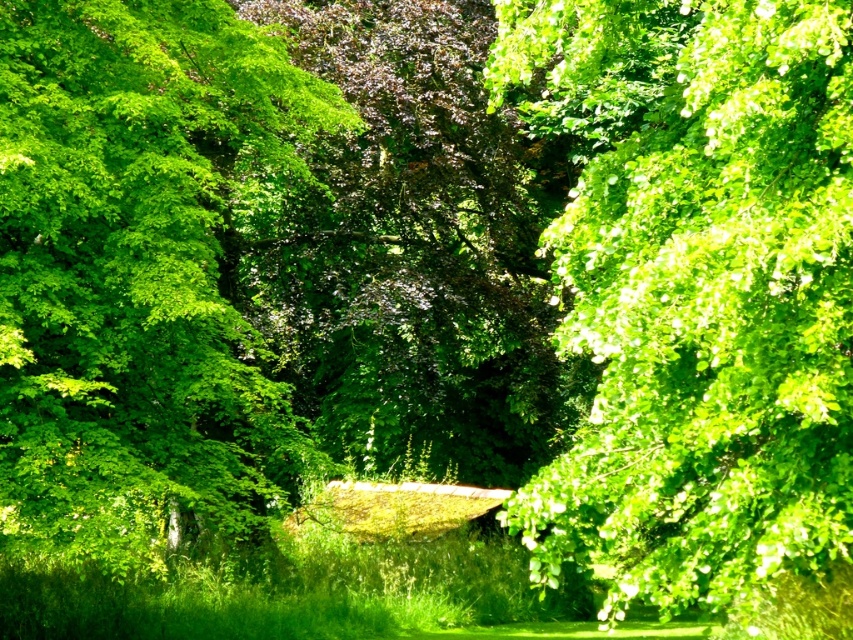
Does green leafy tree at left have a lesser height compared to green leafy tree at center?

Incorrect, green leafy tree at left's height does not fall short of green leafy tree at center's.

Is green leafy tree at left further to the viewer compared to green leafy tree at center?

No, green leafy tree at left is closer to the viewer.

Identify the location of green leafy tree at left. The width and height of the screenshot is (853, 640). (137, 275).

You are a GUI agent. You are given a task and a screenshot of the screen. Output one action in this format:
    pyautogui.click(x=<x>, y=<y>)
    Task: Click on the green leafy tree at left
    The height and width of the screenshot is (640, 853).
    Given the screenshot: What is the action you would take?
    pyautogui.click(x=137, y=275)

Between green leafy tree at upper right and green leafy tree at center, which one appears on the right side from the viewer's perspective?

From the viewer's perspective, green leafy tree at upper right appears more on the right side.

Which is behind, point (691, 195) or point (323, 44)?

The point (323, 44) is more distant.

Does point (514, 4) lie in front of point (347, 250)?

Yes, point (514, 4) is in front of point (347, 250).

Image resolution: width=853 pixels, height=640 pixels. Find the location of `green leafy tree at upper right`. green leafy tree at upper right is located at coordinates (695, 288).

Measure the distance between green leafy tree at upper right and green leafy tree at left.

They are 4.98 meters apart.

Who is more forward, (691,420) or (96,288)?

Positioned in front is point (691,420).

What do you see at coordinates (695, 288) in the screenshot? I see `green leafy tree at upper right` at bounding box center [695, 288].

Identify the location of green leafy tree at upper right. (695, 288).